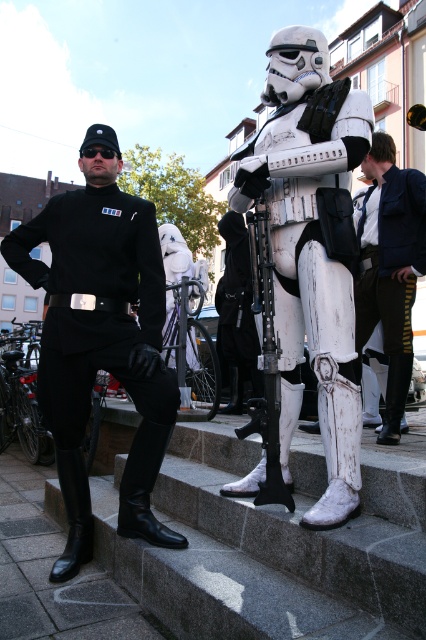
Question: Does black matte uniform at center lie in front of white matte boot at lower right?

Choices:
 (A) yes
 (B) no

Answer: (A)

Question: Which object is positioned farthest from the shiny blue vest at center?

Choices:
 (A) white matte boot at lower right
 (B) black leather boot at lower center

Answer: (B)

Question: Can you confirm if black matte uniform at center is positioned above black leather boot at lower center?

Choices:
 (A) no
 (B) yes

Answer: (B)

Question: Which of the following is the closest to the observer?

Choices:
 (A) white matte stormtrooper at center
 (B) black leather boot at lower center
 (C) black matte uniform at center
 (D) shiny blue vest at center

Answer: (A)

Question: Is black matte uniform at center bigger than shiny blue vest at center?

Choices:
 (A) yes
 (B) no

Answer: (A)

Question: Among these objects, which one is farthest from the camera?

Choices:
 (A) black leather boot at lower left
 (B) black matte uniform at center

Answer: (A)